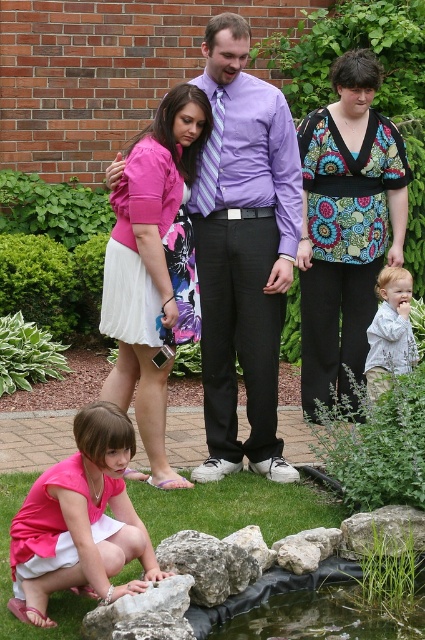
Question: Does pink matte dress at lower left come in front of gray rough rock at lower left?

Choices:
 (A) yes
 (B) no

Answer: (B)

Question: Does pink satin skirt at center come in front of gray rough rock at lower left?

Choices:
 (A) yes
 (B) no

Answer: (B)

Question: Which object is the farthest from the smooth gray rock at center?

Choices:
 (A) floral fabric blouse at center
 (B) gray rough rock at lower center
 (C) light gray textured shirt at lower right
 (D) matte purple shirt at center

Answer: (A)

Question: Which of these objects is positioned farthest from the gray rock at lower center?

Choices:
 (A) pink satin skirt at center
 (B) pink matte dress at lower left
 (C) matte purple shirt at center

Answer: (A)

Question: Which object appears farthest from the camera in this image?

Choices:
 (A) gray rock at center
 (B) gray rough rock at lower left
 (C) smooth gray rock at center
 (D) gray rock at lower center

Answer: (D)

Question: Does floral fabric blouse at center appear under gray rough rock at lower left?

Choices:
 (A) yes
 (B) no

Answer: (B)